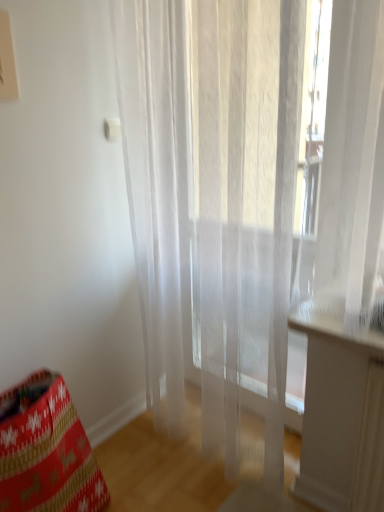
What do you see at coordinates (46, 451) in the screenshot? The image size is (384, 512). I see `red knit bean bag chair at lower left` at bounding box center [46, 451].

Where is `red knit bean bag chair at lower left`? Image resolution: width=384 pixels, height=512 pixels. red knit bean bag chair at lower left is located at coordinates (46, 451).

The image size is (384, 512). I want to click on transparent fabric curtain at center, so click(213, 197).

What do you see at coordinates (213, 197) in the screenshot? The height and width of the screenshot is (512, 384). I see `transparent fabric curtain at center` at bounding box center [213, 197].

Locate an element on the screen. Image resolution: width=384 pixels, height=512 pixels. red knit bean bag chair at lower left is located at coordinates (46, 451).

Considering the relative positions of transparent fabric curtain at center and red knit bean bag chair at lower left in the image provided, is transparent fabric curtain at center to the left of red knit bean bag chair at lower left from the viewer's perspective?

No.

Who is more distant, transparent fabric curtain at center or red knit bean bag chair at lower left?

red knit bean bag chair at lower left.

Considering the positions of point (355, 169) and point (8, 432), is point (355, 169) closer or farther from the camera than point (8, 432)?

Point (355, 169) is closer to the camera than point (8, 432).

From the image's perspective, is transparent fabric curtain at center under red knit bean bag chair at lower left?

Incorrect, from the image's perspective, transparent fabric curtain at center is higher than red knit bean bag chair at lower left.

From a real-world perspective, which object rests below the other?

red knit bean bag chair at lower left.

Does transparent fabric curtain at center have a greater width compared to red knit bean bag chair at lower left?

Incorrect, the width of transparent fabric curtain at center does not surpass that of red knit bean bag chair at lower left.

Who is taller, transparent fabric curtain at center or red knit bean bag chair at lower left?

Standing taller between the two is transparent fabric curtain at center.

Considering the relative sizes of transparent fabric curtain at center and red knit bean bag chair at lower left in the image provided, is transparent fabric curtain at center bigger than red knit bean bag chair at lower left?

Yes.

Do you think transparent fabric curtain at center is within red knit bean bag chair at lower left, or outside of it?

transparent fabric curtain at center is not enclosed by red knit bean bag chair at lower left.

Is transparent fabric curtain at center touching red knit bean bag chair at lower left?

No, transparent fabric curtain at center is not in contact with red knit bean bag chair at lower left.

Is red knit bean bag chair at lower left at the back of transparent fabric curtain at center?

transparent fabric curtain at center does not have its back to red knit bean bag chair at lower left.

The height and width of the screenshot is (512, 384). What are the coordinates of `bean bag chair behind the transparent fabric curtain at center` in the screenshot? It's located at (46, 451).

Which is more to the right, red knit bean bag chair at lower left or transparent fabric curtain at center?

transparent fabric curtain at center is more to the right.

Between red knit bean bag chair at lower left and transparent fabric curtain at center, which one is positioned behind?

red knit bean bag chair at lower left is more distant.

Which is closer, (62,464) or (195,6)?

The point (195,6) is closer.

From the image's perspective, is red knit bean bag chair at lower left located beneath transparent fabric curtain at center?

Yes, from the image's perspective, red knit bean bag chair at lower left is beneath transparent fabric curtain at center.

From a real-world perspective, is red knit bean bag chair at lower left located beneath transparent fabric curtain at center?

Yes, from a real-world perspective, red knit bean bag chair at lower left is beneath transparent fabric curtain at center.

From the picture: Looking at their sizes, would you say red knit bean bag chair at lower left is wider or thinner than transparent fabric curtain at center?

In the image, red knit bean bag chair at lower left appears to be wider than transparent fabric curtain at center.

Who is shorter, red knit bean bag chair at lower left or transparent fabric curtain at center?

red knit bean bag chair at lower left.

Looking at the image, does red knit bean bag chair at lower left seem bigger or smaller compared to transparent fabric curtain at center?

Clearly, red knit bean bag chair at lower left is smaller in size than transparent fabric curtain at center.

Is transparent fabric curtain at center a part of red knit bean bag chair at lower left?

Actually, transparent fabric curtain at center is outside red knit bean bag chair at lower left.

Is red knit bean bag chair at lower left not near transparent fabric curtain at center?

red knit bean bag chair at lower left is near transparent fabric curtain at center, not far away.

Is red knit bean bag chair at lower left oriented towards transparent fabric curtain at center?

No.

Where is `bean bag chair lying on the left of transparent fabric curtain at center`? bean bag chair lying on the left of transparent fabric curtain at center is located at coordinates (46, 451).

Find the location of `bean bag chair that appears below the transparent fabric curtain at center (from the image's perspective)`. bean bag chair that appears below the transparent fabric curtain at center (from the image's perspective) is located at coordinates (46, 451).

There is a red knit bean bag chair at lower left. At what (x,y) coordinates should I click in order to perform the action: click on curtain above it (from a real-world perspective). Please return your answer as a coordinate pair (x, y). This screenshot has height=512, width=384. Looking at the image, I should click on (213, 197).